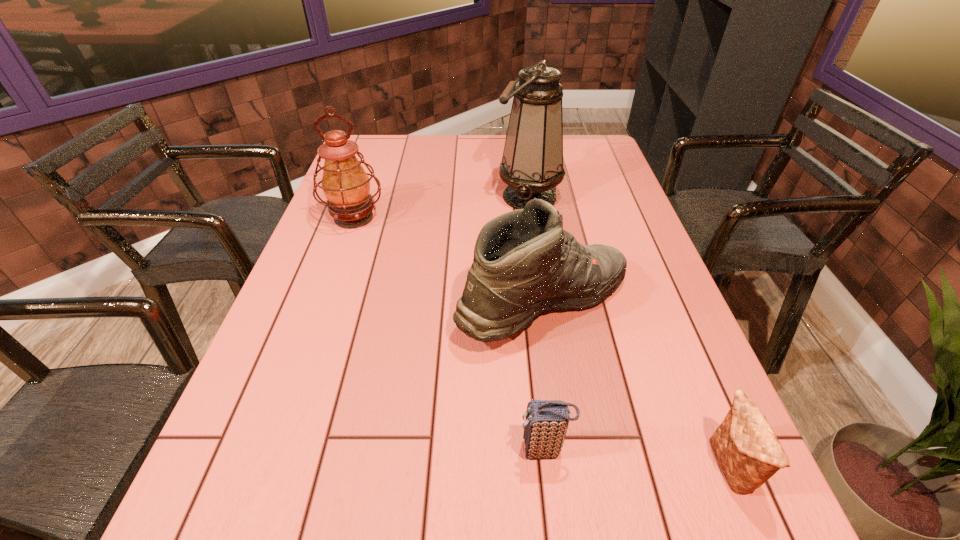
Find the location of a particular element. free point located on the back of the third shortest object is located at coordinates (531, 213).

The height and width of the screenshot is (540, 960). Identify the location of vacant space located 0.390m with the zip open on the left clutch bag. (299, 450).

I want to click on free space located with the zip open on the left clutch bag, so click(x=304, y=450).

Where is `free region located with the zip open on the left clutch bag`? This screenshot has height=540, width=960. free region located with the zip open on the left clutch bag is located at coordinates click(304, 450).

This screenshot has height=540, width=960. I want to click on vacant area situated on the open side of the right clutch bag, so click(532, 467).

Find the location of a particular element. Image resolution: width=960 pixels, height=540 pixels. free location located 0.140m on the open side of the right clutch bag is located at coordinates (631, 467).

Where is `vacant space located 0.340m on the open side of the right clutch bag`? vacant space located 0.340m on the open side of the right clutch bag is located at coordinates (515, 467).

This screenshot has width=960, height=540. Identify the location of object that is at the left edge. (345, 184).

Locate an element on the screen. This screenshot has height=540, width=960. ski boot situated at the right edge is located at coordinates (524, 262).

This screenshot has height=540, width=960. Identify the location of clutch bag at the right edge. (747, 450).